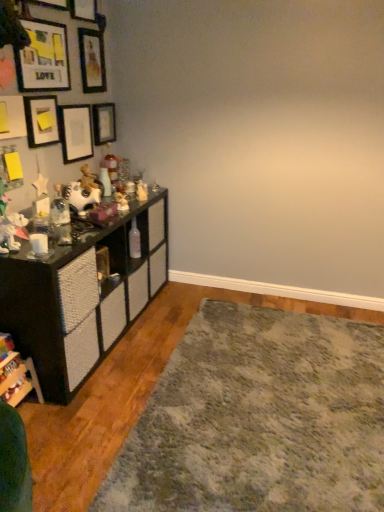
Where is `vacant area that is situated to the right of black textured cabinet at left, acting as the second shelf starting from the front`? vacant area that is situated to the right of black textured cabinet at left, acting as the second shelf starting from the front is located at coordinates (183, 312).